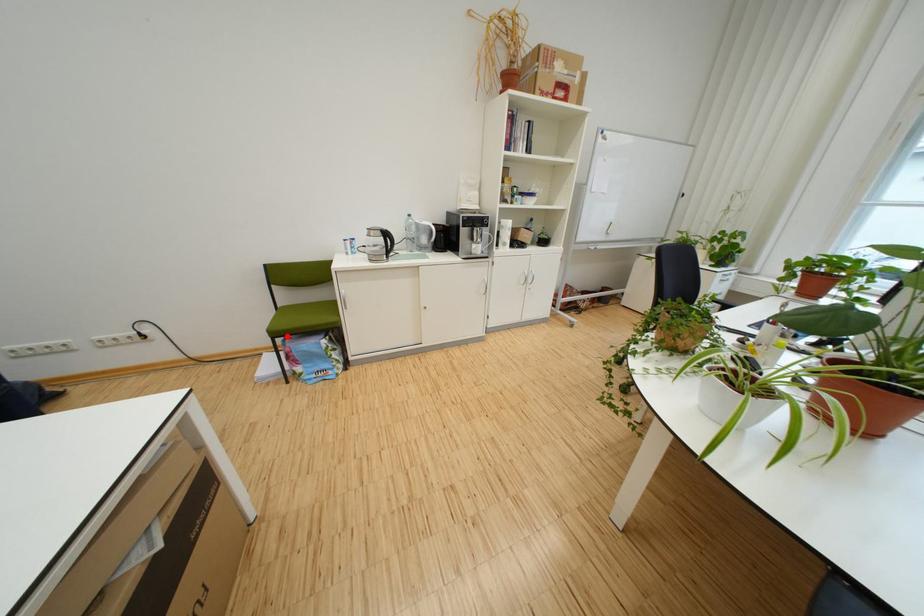
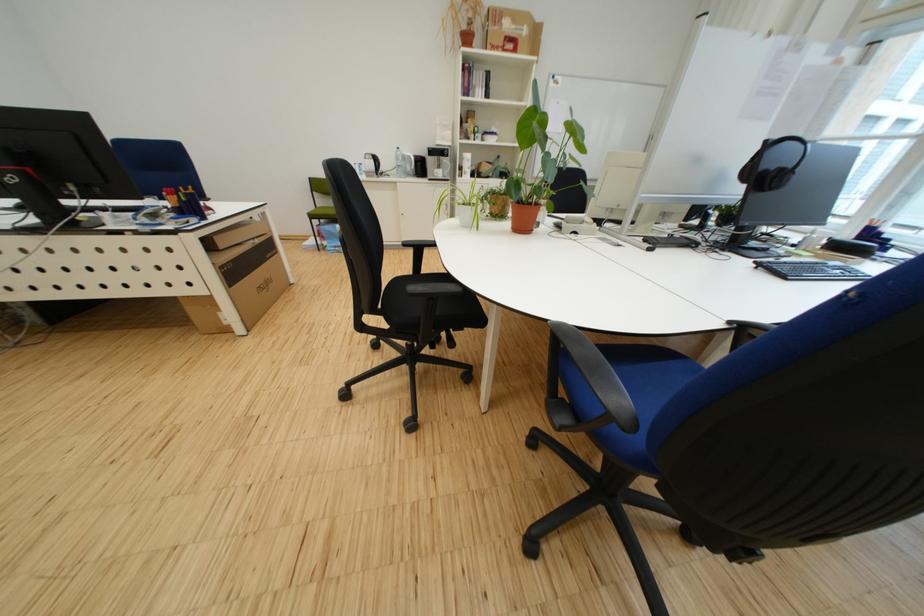
Question: A red point is marked in image1. In image2, is the corresponding 3D point closer to the camera or farther? Reply with the corresponding letter.

Choices:
 (A) The corresponding 3D point is closer.
 (B) The corresponding 3D point is farther.

Answer: (A)